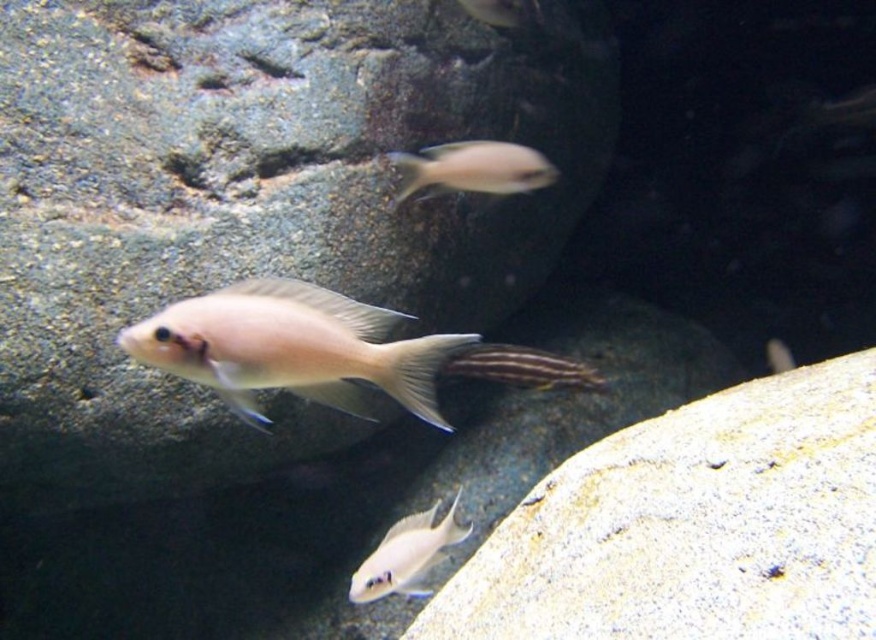
Question: Which object appears farthest from the camera in this image?

Choices:
 (A) white matte rock at lower right
 (B) pale pink matte fish at center

Answer: (B)

Question: Is white matte fish at lower center to the right of silvery metallic fish at upper center from the viewer's perspective?

Choices:
 (A) no
 (B) yes

Answer: (A)

Question: Which is farther from the striped fin at center?

Choices:
 (A) white matte rock at lower right
 (B) pale pink matte fish at center

Answer: (A)

Question: Does white matte rock at lower right have a lesser width compared to pale pink matte fish at center?

Choices:
 (A) no
 (B) yes

Answer: (A)

Question: Which object appears closest to the camera in this image?

Choices:
 (A) silvery metallic fish at upper center
 (B) pale pink matte fish at center
 (C) white matte fish at lower center
 (D) white matte rock at lower right

Answer: (D)

Question: Does white matte fish at lower center appear over silvery metallic fish at upper center?

Choices:
 (A) no
 (B) yes

Answer: (A)